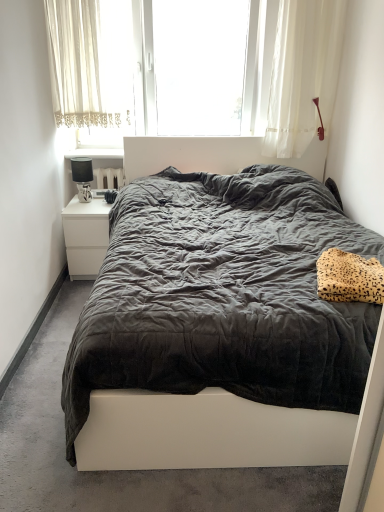
Question: Is white glossy nightstand at left not close to white sheer curtain at upper center?

Choices:
 (A) yes
 (B) no

Answer: (B)

Question: Does white glossy nightstand at left have a greater width compared to white sheer curtain at upper center?

Choices:
 (A) no
 (B) yes

Answer: (B)

Question: From a real-world perspective, is white glossy nightstand at left positioned under white sheer curtain at upper center based on gravity?

Choices:
 (A) yes
 (B) no

Answer: (A)

Question: From the image's perspective, is white glossy nightstand at left beneath white sheer curtain at upper center?

Choices:
 (A) yes
 (B) no

Answer: (A)

Question: Does white glossy nightstand at left touch white sheer curtain at upper center?

Choices:
 (A) yes
 (B) no

Answer: (B)

Question: Is point (94, 100) positioned closer to the camera than point (208, 139)?

Choices:
 (A) farther
 (B) closer

Answer: (B)

Question: Visually, is white sheer curtain at upper center positioned to the left or to the right of dark grey fabric bed at center?

Choices:
 (A) right
 (B) left

Answer: (B)

Question: Is white sheer curtain at upper center spatially inside dark grey fabric bed at center, or outside of it?

Choices:
 (A) inside
 (B) outside

Answer: (B)

Question: Based on their sizes in the image, would you say white sheer curtain at upper center is bigger or smaller than dark grey fabric bed at center?

Choices:
 (A) big
 (B) small

Answer: (B)

Question: In terms of width, does white glossy nightstand at upper left look wider or thinner when compared to white sheer curtain at upper center?

Choices:
 (A) wide
 (B) thin

Answer: (A)

Question: Based on their positions, is white glossy nightstand at upper left located to the left or right of white sheer curtain at upper center?

Choices:
 (A) right
 (B) left

Answer: (B)

Question: Does point (82, 157) appear closer or farther from the camera than point (312, 18)?

Choices:
 (A) farther
 (B) closer

Answer: (A)

Question: In the image, is white glossy nightstand at upper left positioned in front of or behind white sheer curtain at upper center?

Choices:
 (A) front
 (B) behind

Answer: (B)

Question: From the image's perspective, relative to matte black lamp at left, is leopard print fabric pillow at right above or below?

Choices:
 (A) above
 (B) below

Answer: (B)

Question: Is point (339, 269) closer or farther from the camera than point (82, 161)?

Choices:
 (A) closer
 (B) farther

Answer: (A)